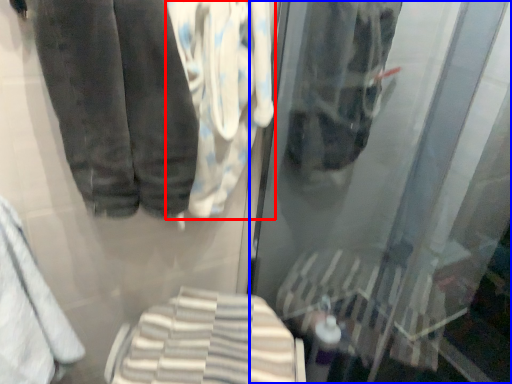
Question: Which object appears farthest to the camera in this image, cloth (highlighted by a red box) or shop window (highlighted by a blue box)?

Choices:
 (A) cloth
 (B) shop window

Answer: (A)